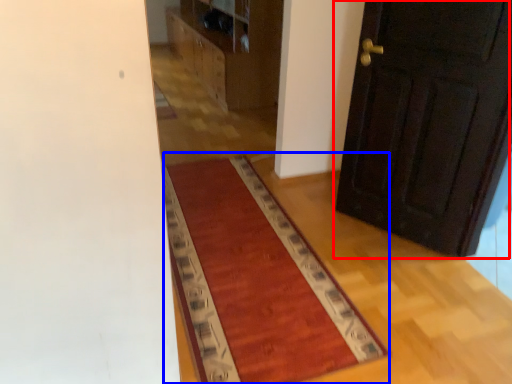
Question: Which object is further to the camera taking this photo, door (highlighted by a red box) or mat (highlighted by a blue box)?

Choices:
 (A) door
 (B) mat

Answer: (A)